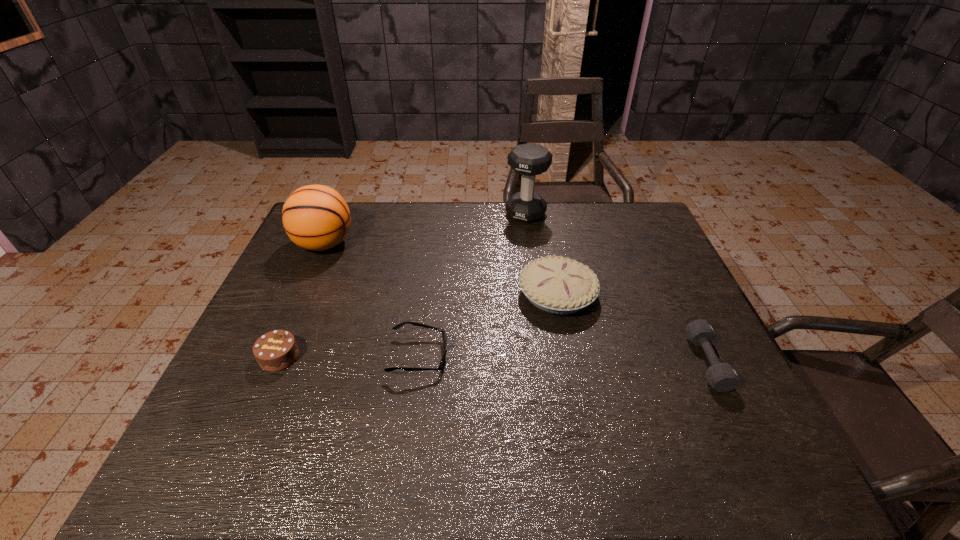
Where is `free space located on the front of the farthest object`? free space located on the front of the farthest object is located at coordinates (539, 306).

This screenshot has width=960, height=540. Identify the location of free space located on the front of the fifth nearest object. click(292, 317).

Where is `vacant space located 0.290m on the left of the pie`? vacant space located 0.290m on the left of the pie is located at coordinates (413, 295).

Image resolution: width=960 pixels, height=540 pixels. In order to click on vacant space situated 0.210m on the front of the chocolate cake in this screenshot , I will do `click(234, 461)`.

Find the location of a particular element. free space located 0.130m on the left of the rightmost object is located at coordinates (639, 362).

The width and height of the screenshot is (960, 540). I want to click on free location located 0.050m on the lenses of the sunglasses, so click(x=468, y=356).

Image resolution: width=960 pixels, height=540 pixels. Find the location of `dumbbell that is at the far edge`. dumbbell that is at the far edge is located at coordinates (529, 160).

This screenshot has width=960, height=540. Identify the location of basketball positioned at the far edge. tap(315, 217).

You are a GUI agent. You are given a task and a screenshot of the screen. Output one action in this format:
    pyautogui.click(x=<x>, y=<y>)
    Task: Click on the basketball at the left edge
    
    Given the screenshot: What is the action you would take?
    pyautogui.click(x=315, y=217)

At what (x,y) coordinates should I click in order to perform the action: click on chocolate cake that is at the left edge. Please return your answer as a coordinate pair (x, y). This screenshot has width=960, height=540. Looking at the image, I should click on (276, 350).